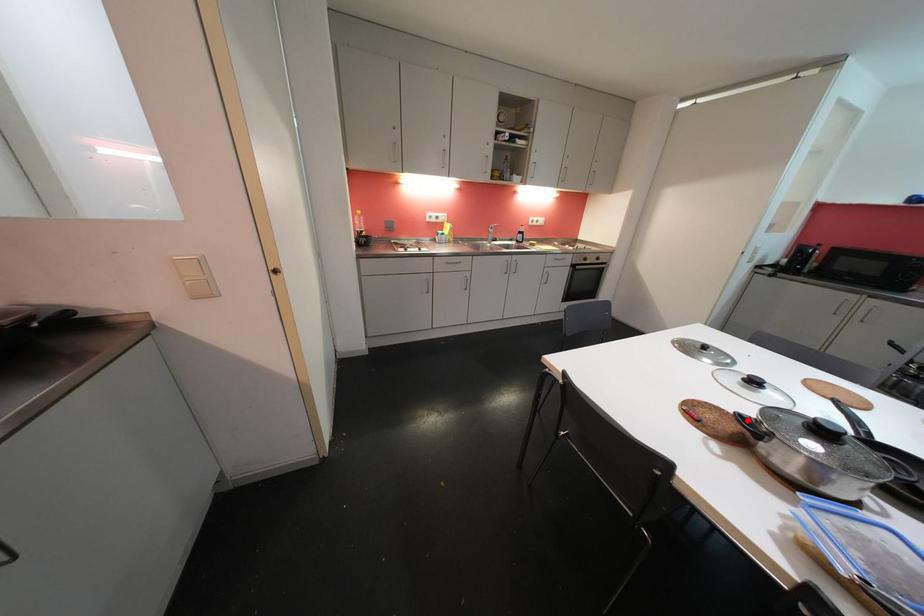
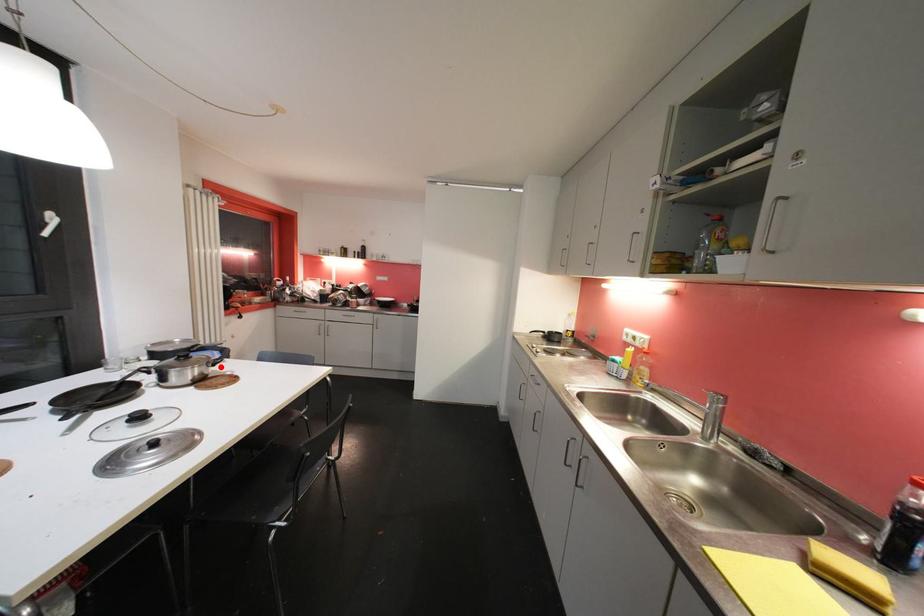
From the picture: I am providing you with two images of the same scene from different viewpoints. A red point is marked on the first image and another point is marked on the second image. Is the red point in image1 aligned with the point shown in image2?

Yes